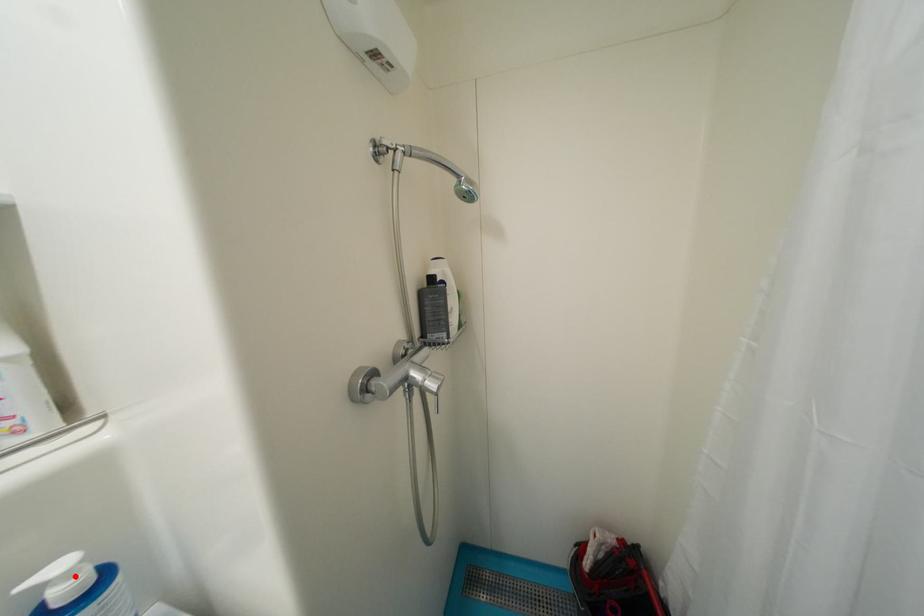
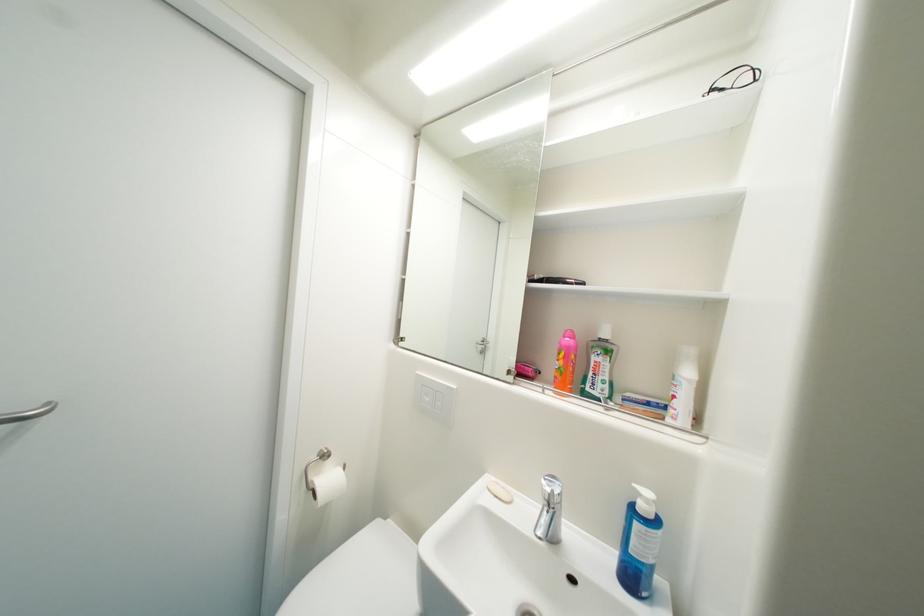
Find the pixel in the second image that matches the highlighted location in the first image.

(653, 503)